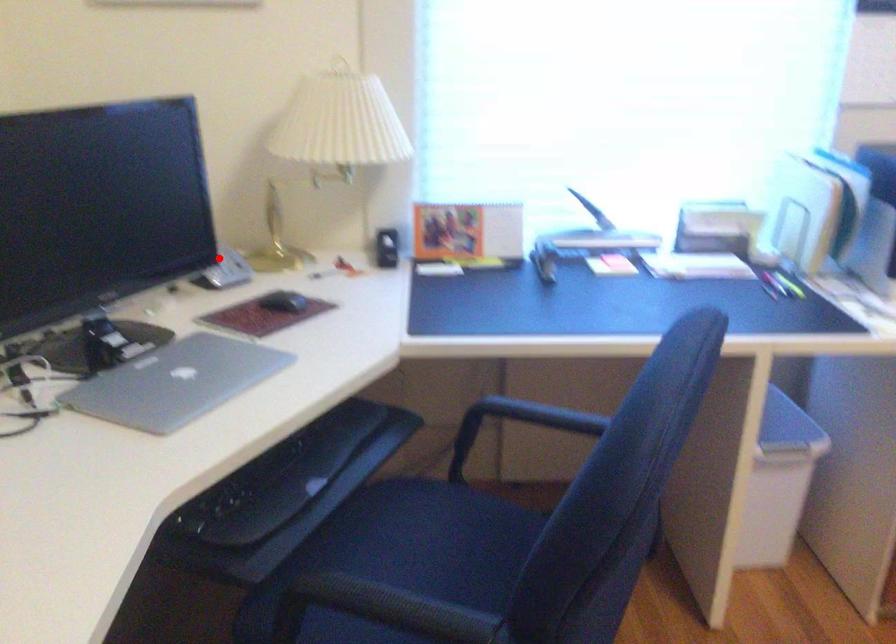
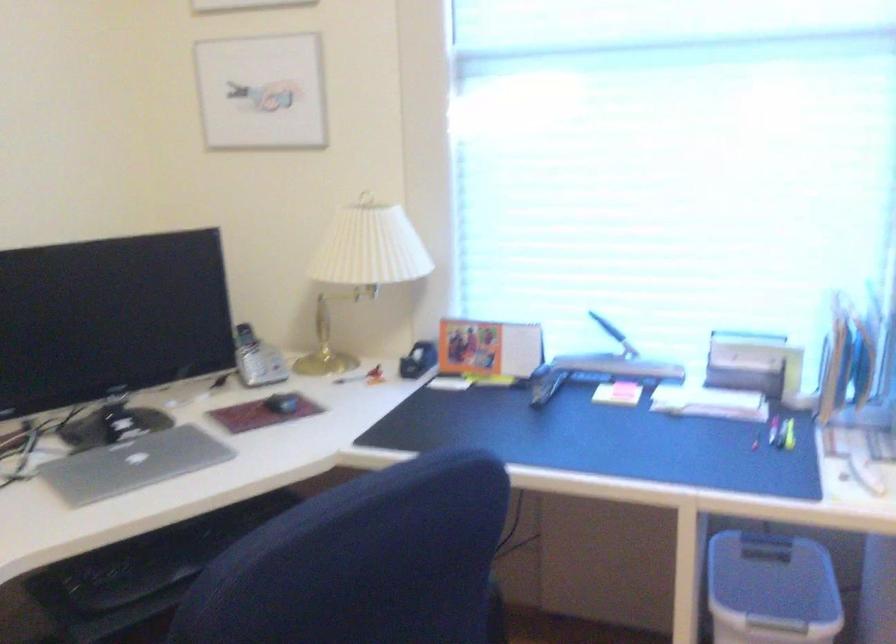
In the second image, find the point that corresponds to the highlighted location in the first image.

(256, 359)